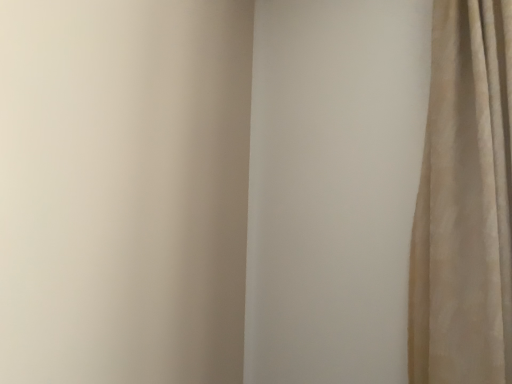
Where is `beige textured curtain at right`? beige textured curtain at right is located at coordinates (465, 202).

Image resolution: width=512 pixels, height=384 pixels. What do you see at coordinates (465, 202) in the screenshot?
I see `beige textured curtain at right` at bounding box center [465, 202].

What are the coordinates of `beige textured curtain at right` in the screenshot? It's located at (465, 202).